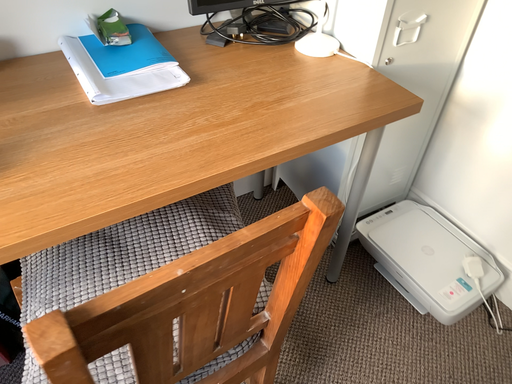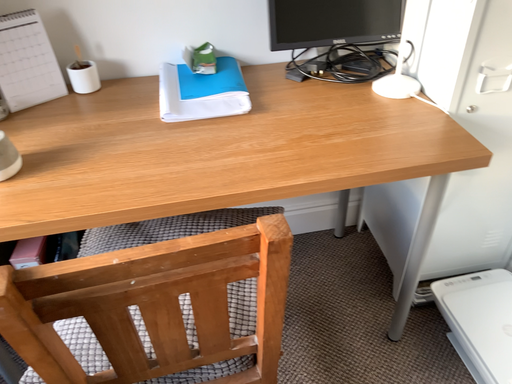
Question: Which way did the camera rotate in the video?

Choices:
 (A) rotated right
 (B) rotated left

Answer: (B)